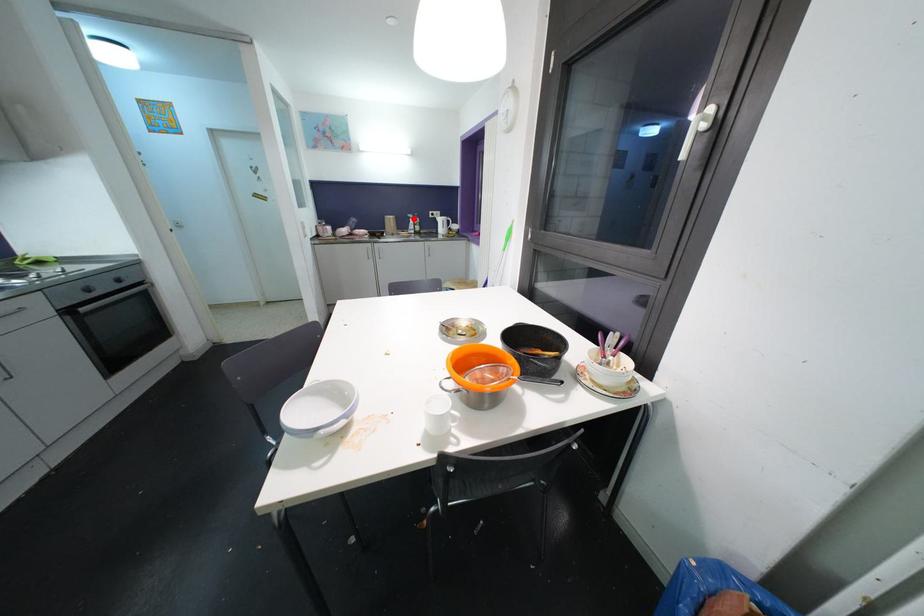
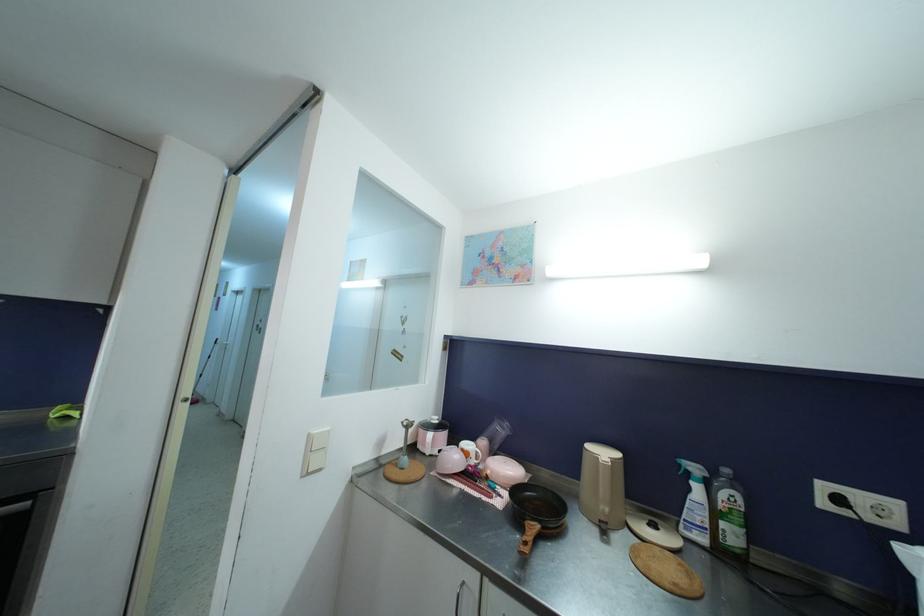
Question: A red point is marked in image1. In image2, is the corresponding 3D point closer to the camera or farther? Reply with the corresponding letter.

Choices:
 (A) The corresponding 3D point is closer.
 (B) The corresponding 3D point is farther.

Answer: (B)